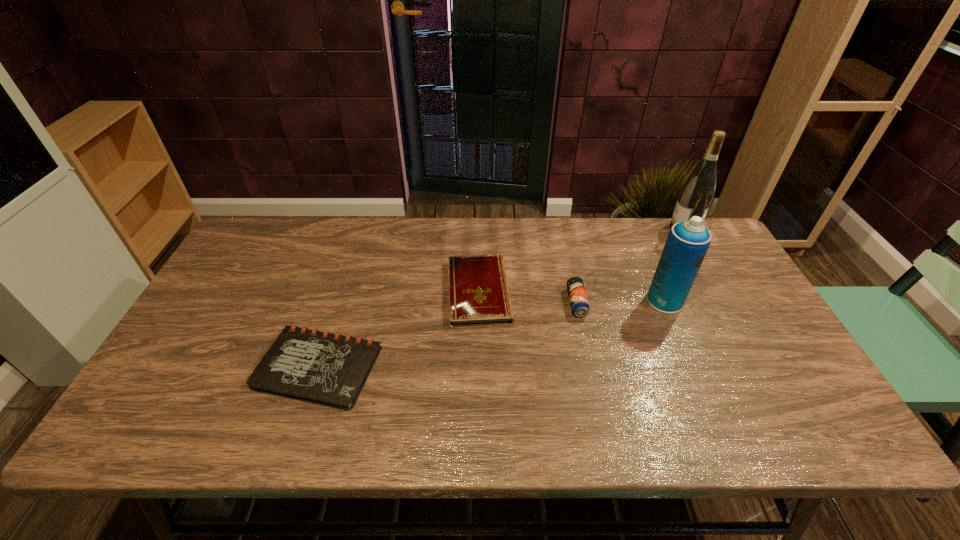
Locate an element on the screen. This screenshot has width=960, height=540. vacant position located 0.160m on the label of the farthest object is located at coordinates (623, 228).

Find the location of a particular element. free space located 0.280m on the label of the farthest object is located at coordinates (588, 228).

Locate an element on the screen. This screenshot has width=960, height=540. vacant region located 0.280m on the label of the farthest object is located at coordinates pos(588,228).

Identify the location of free space located 0.200m on the front of the aerosol can. (696, 375).

Identify the location of vacant space located on the back of the beer can. The image size is (960, 540). (564, 243).

The width and height of the screenshot is (960, 540). Find the location of `vacant point located 0.330m on the right of the nearer notebook`. vacant point located 0.330m on the right of the nearer notebook is located at coordinates (512, 368).

The width and height of the screenshot is (960, 540). What are the coordinates of `free location located 0.310m on the right of the right notebook` in the screenshot? It's located at (618, 292).

Image resolution: width=960 pixels, height=540 pixels. Find the location of `wine bottle that is at the far edge`. wine bottle that is at the far edge is located at coordinates (696, 195).

Identify the location of notebook located in the far edge section of the desktop. (479, 295).

Image resolution: width=960 pixels, height=540 pixels. Find the location of `object situated at the near edge`. object situated at the near edge is located at coordinates (329, 369).